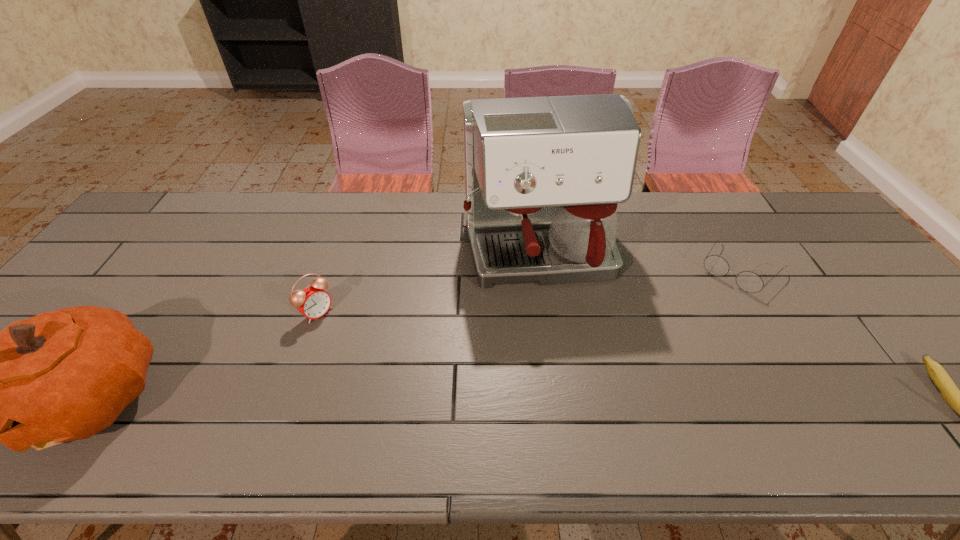
Where is `vacant spot on the desktop that is between the pumpkin and the rightmost object and is positioned on the temples of the second object from right to left`? vacant spot on the desktop that is between the pumpkin and the rightmost object and is positioned on the temples of the second object from right to left is located at coordinates (635, 397).

Find the location of a particular element. vacant space on the desktop that is between the second tallest object and the banana and is positioned on the front of the coffee maker near the spout is located at coordinates (576, 397).

At what (x,y) coordinates should I click in order to perform the action: click on free space on the desktop that is between the pumpkin and the banana and is positioned on the clock face of the fourth object from right to left. Please return your answer as a coordinate pair (x, y). This screenshot has height=540, width=960. Looking at the image, I should click on (411, 397).